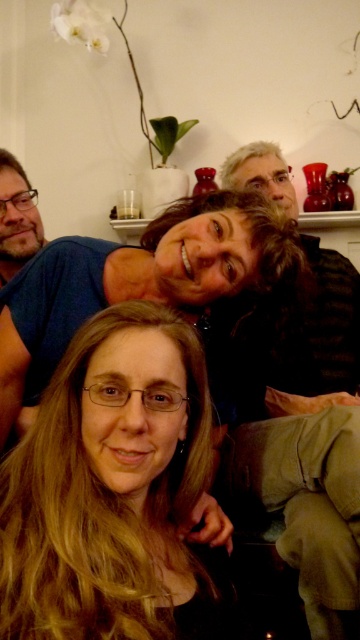
Question: Which object appears farthest from the camera in this image?

Choices:
 (A) dark brown textured jacket at upper right
 (B) blonde hair at center
 (C) matte black hair at lower left

Answer: (A)

Question: Does blonde hair at center appear under dark brown textured jacket at upper right?

Choices:
 (A) yes
 (B) no

Answer: (A)

Question: Is blonde hair at center to the right of dark brown textured jacket at upper right from the viewer's perspective?

Choices:
 (A) no
 (B) yes

Answer: (A)

Question: Can you confirm if dark brown textured jacket at upper right is bigger than matte black hair at lower left?

Choices:
 (A) no
 (B) yes

Answer: (B)

Question: Which of the following is the closest to the observer?

Choices:
 (A) (304, 497)
 (B) (11, 332)

Answer: (B)

Question: Which object is closer to the camera taking this photo?

Choices:
 (A) matte black hair at lower left
 (B) dark brown textured jacket at upper right

Answer: (A)